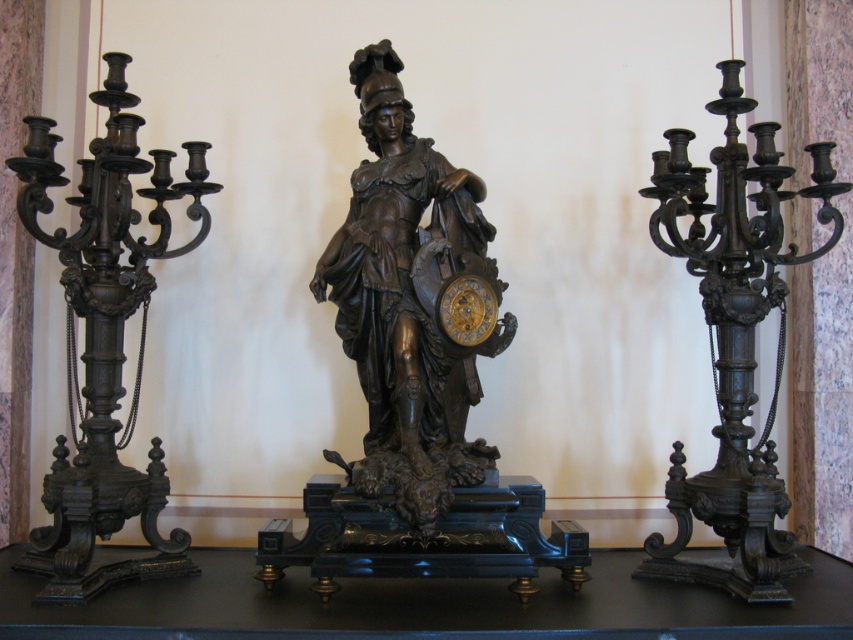
Who is shorter, bronze statue at center or gold polished metal clock at center?

With less height is gold polished metal clock at center.

Is bronze statue at center further to the viewer compared to gold polished metal clock at center?

Result: No.

Is point (489, 480) farther from camera compared to point (460, 321)?

No.

Locate an element on the screen. bronze statue at center is located at coordinates (413, 378).

Based on the photo, does polished bronze candelabra at left come in front of matte black candelabra at right?

Yes, it is in front of matte black candelabra at right.

Locate an element on the screen. polished bronze candelabra at left is located at coordinates (103, 342).

Is point (56, 552) more distant than point (776, 220)?

No, (56, 552) is closer to viewer.

Find the location of a particular element. The width and height of the screenshot is (853, 640). polished bronze candelabra at left is located at coordinates (103, 342).

Is bronze statue at center wider than polished bronze candelabra at left?

Yes, bronze statue at center is wider than polished bronze candelabra at left.

Which is in front, point (397, 289) or point (73, 250)?

Point (397, 289)

The width and height of the screenshot is (853, 640). What are the coordinates of `bronze statue at center` in the screenshot? It's located at (413, 378).